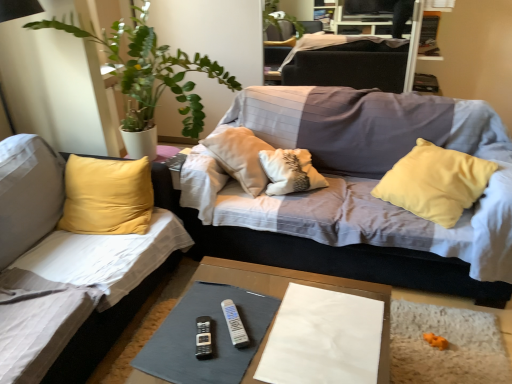
Question: From a real-world perspective, does black plastic remote at center, the 1th remote in the left-to-right sequence, sit lower than white paper at center?

Choices:
 (A) no
 (B) yes

Answer: (B)

Question: Is black plastic remote at center, the 1th remote in the left-to-right sequence, thinner than white paper at center?

Choices:
 (A) no
 (B) yes

Answer: (B)

Question: Does black plastic remote at center, which is the second remote from right to left, have a smaller size compared to white paper at center?

Choices:
 (A) yes
 (B) no

Answer: (A)

Question: Is black plastic remote at center, the 1th remote in the left-to-right sequence, positioned with its back to white paper at center?

Choices:
 (A) yes
 (B) no

Answer: (B)

Question: Is black plastic remote at center, which is the second remote from right to left, shorter than white paper at center?

Choices:
 (A) no
 (B) yes

Answer: (B)

Question: From their relative heights in the image, would you say white plastic remote at center, which is the 1th remote from right to left, is taller or shorter than smooth gray fabric at center?

Choices:
 (A) tall
 (B) short

Answer: (B)

Question: From the image's perspective, is white plastic remote at center, which is the 1th remote from right to left, positioned above or below smooth gray fabric at center?

Choices:
 (A) below
 (B) above

Answer: (B)

Question: Is white plastic remote at center, which is counted as the second remote, starting from the left, in front of or behind smooth gray fabric at center in the image?

Choices:
 (A) front
 (B) behind

Answer: (B)

Question: Looking at their shapes, would you say white plastic remote at center, which is the 1th remote from right to left, is wider or thinner than smooth gray fabric at center?

Choices:
 (A) thin
 (B) wide

Answer: (A)

Question: In terms of size, does white paper at center appear bigger or smaller than white plastic remote at center, which is the 1th remote from right to left?

Choices:
 (A) big
 (B) small

Answer: (A)

Question: Is point (339, 334) positioned closer to the camera than point (243, 327)?

Choices:
 (A) farther
 (B) closer

Answer: (B)

Question: Which is correct: white paper at center is inside white plastic remote at center, which is counted as the second remote, starting from the left, or outside of it?

Choices:
 (A) outside
 (B) inside

Answer: (A)

Question: Visually, is white paper at center positioned to the left or to the right of white plastic remote at center, which is counted as the second remote, starting from the left?

Choices:
 (A) right
 (B) left

Answer: (A)

Question: Is green leafy plant at left wider or thinner than yellow fabric studio couch at left, the 2th studio couch viewed from the right?

Choices:
 (A) wide
 (B) thin

Answer: (B)

Question: In terms of size, does green leafy plant at left appear bigger or smaller than yellow fabric studio couch at left, the 2th studio couch viewed from the right?

Choices:
 (A) small
 (B) big

Answer: (A)